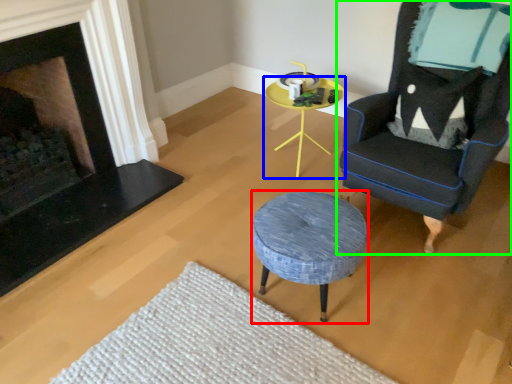
Question: Considering the real-world distances, which object is closest to stool (highlighted by a red box)? table (highlighted by a blue box) or chair (highlighted by a green box).

Choices:
 (A) table
 (B) chair

Answer: (B)